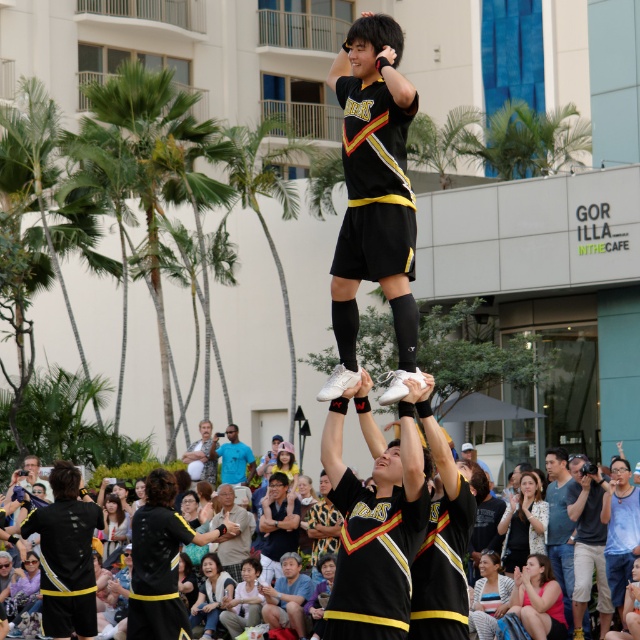
You are a photographer trying to capture the cheerleader in the center. You notice the black matte jersey at center and the white matte sneakers at center. Which object should you focus on to ensure the subject is properly framed?

The black matte jersey at center is larger in size than the white matte sneakers at center, so focusing on the black matte jersey at center will ensure proper framing as it occupies more visual space.

You are a photographer standing at the center of the plaza. You want to take a photo of both the point at (403, 211) and the point at (342, 580). Which point is closer to you?

Point at (403, 211) is in front of point at (342, 580), so it is closer to you.

You are a photographer at the event and want to capture a clear shot of the black matte jersey at center and the white matte sneakers at center. Which object should you focus on first if you want to ensure both are in focus?

The black matte jersey at center is located above the white matte sneakers at center. To ensure both are in focus, focus on the white matte sneakers at center first since it is closer to the camera, and the jersey will naturally fall into focus due to its position above.